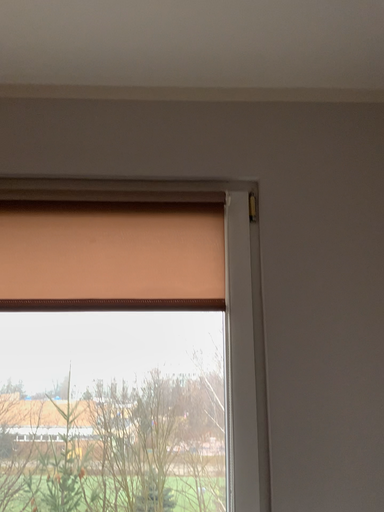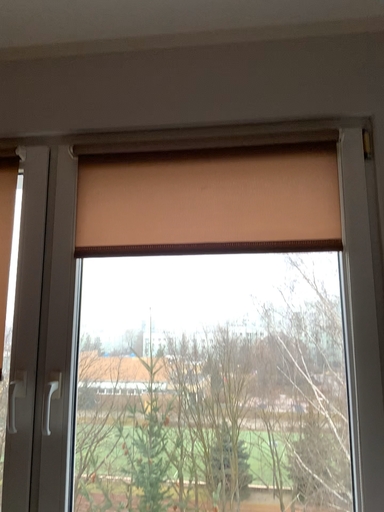
Question: How did the camera likely rotate when shooting the video?

Choices:
 (A) rotated left
 (B) rotated right

Answer: (A)